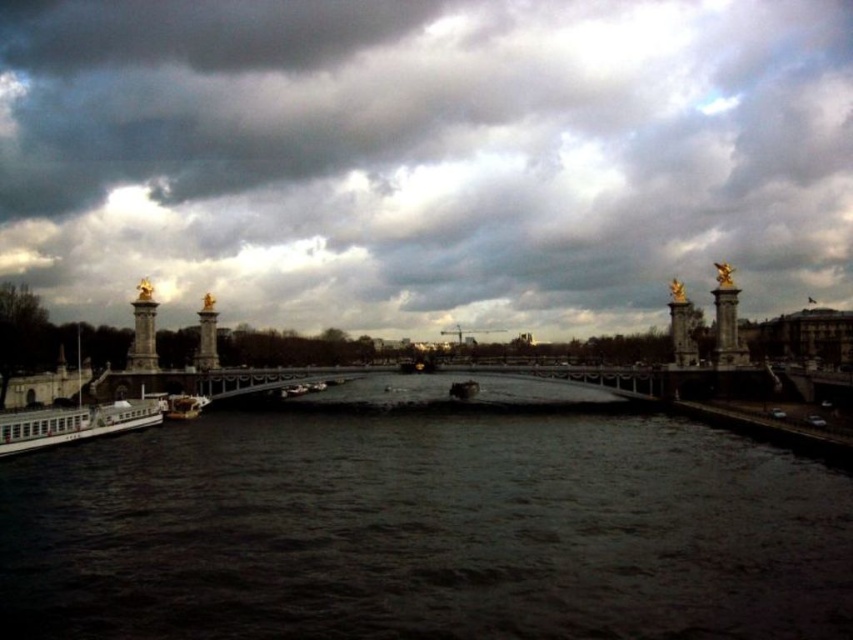
Which is in front, point (103, 400) or point (293, 390)?

Point (103, 400) is more forward.

Is metallic bridge at center thinner than metallic silver boat at center?

No.

Does point (329, 371) lie behind point (303, 387)?

No.

In order to click on metallic bridge at center in this screenshot , I will do `click(209, 380)`.

Can you confirm if dark gray cloud at upper center is smaller than dark water at center?

Incorrect, dark gray cloud at upper center is not smaller in size than dark water at center.

Is point (100, 234) more distant than point (173, 616)?

Yes, point (100, 234) is behind point (173, 616).

Where is `dark gray cloud at upper center`? This screenshot has height=640, width=853. dark gray cloud at upper center is located at coordinates (425, 156).

Which is above, metallic bridge at center or shiny metallic boat at center?

metallic bridge at center is above.

Which is behind, point (281, 387) or point (468, 387)?

Point (468, 387)

Locate an element on the screen. The height and width of the screenshot is (640, 853). metallic bridge at center is located at coordinates (209, 380).